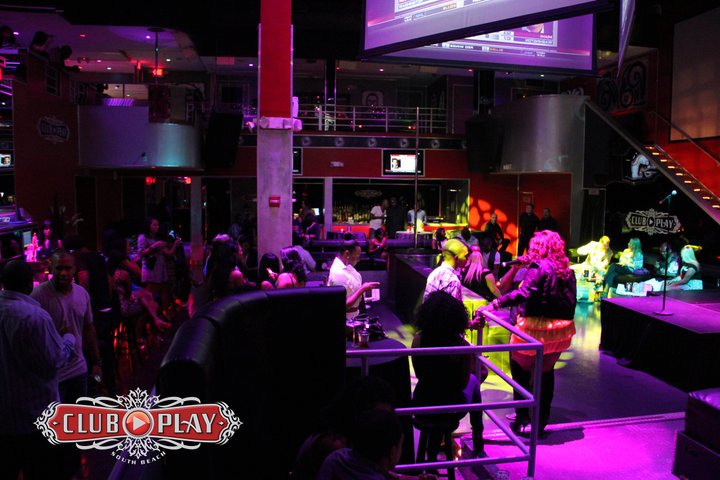
At what (x,y) coordinates should I click in order to perform the action: click on mic stand. Please return your answer as a coordinate pair (x, y). The height and width of the screenshot is (480, 720). Looking at the image, I should click on (664, 265), (662, 309).